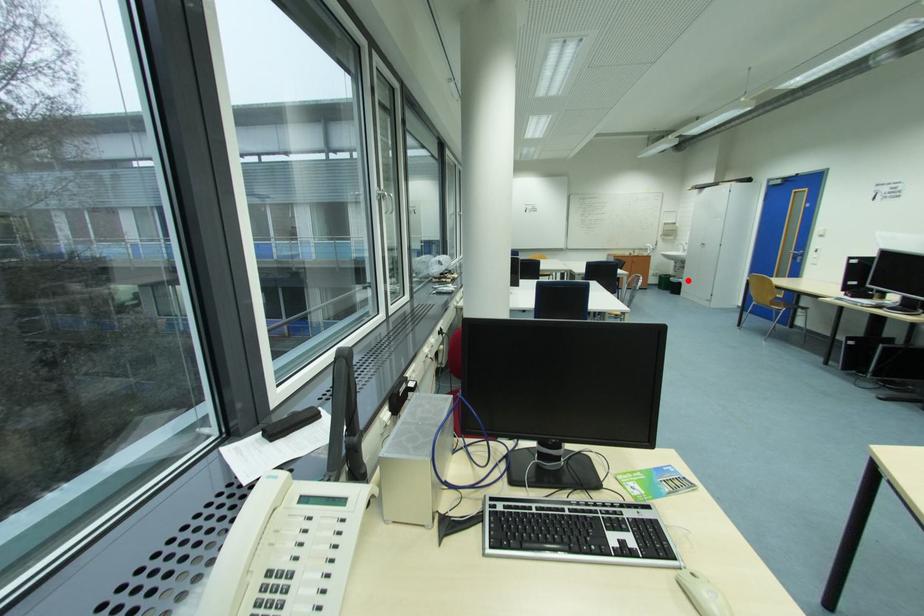
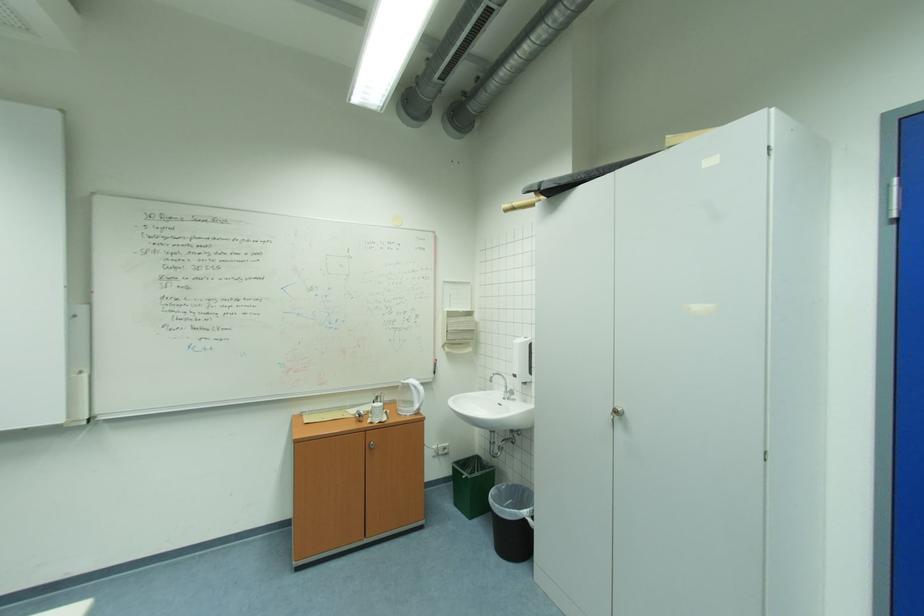
Question: I am providing you with two images of the same scene from different viewpoints. Image1 has a red point marked. In image2, the corresponding 3D location appears at what relative position? Reply with the corresponding letter.

Choices:
 (A) Closer
 (B) Farther

Answer: (B)